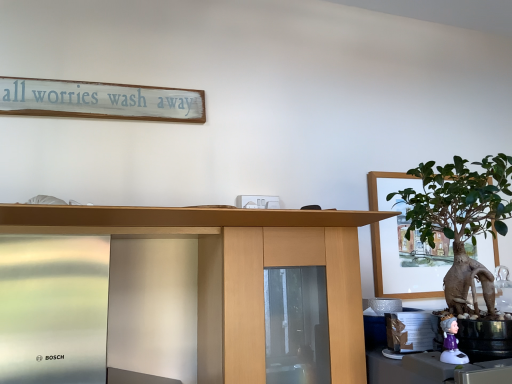
Question: Considering the relative sizes of white plastic figurine at lower right and green matte houseplant at right in the image provided, is white plastic figurine at lower right thinner than green matte houseplant at right?

Choices:
 (A) no
 (B) yes

Answer: (B)

Question: Is white plastic figurine at lower right taller than green matte houseplant at right?

Choices:
 (A) yes
 (B) no

Answer: (B)

Question: Is white plastic figurine at lower right in contact with green matte houseplant at right?

Choices:
 (A) no
 (B) yes

Answer: (A)

Question: Would you say white plastic figurine at lower right is outside green matte houseplant at right?

Choices:
 (A) yes
 (B) no

Answer: (A)

Question: Is white plastic figurine at lower right not near green matte houseplant at right?

Choices:
 (A) yes
 (B) no

Answer: (B)

Question: Is white plastic figurine at lower right behind green matte houseplant at right?

Choices:
 (A) yes
 (B) no

Answer: (A)

Question: From the image's perspective, is green matte houseplant at right below wooden desk at center?

Choices:
 (A) no
 (B) yes

Answer: (A)

Question: Can we say green matte houseplant at right lies outside wooden desk at center?

Choices:
 (A) yes
 (B) no

Answer: (A)

Question: Is green matte houseplant at right thinner than wooden desk at center?

Choices:
 (A) yes
 (B) no

Answer: (A)

Question: Is green matte houseplant at right wider than wooden desk at center?

Choices:
 (A) no
 (B) yes

Answer: (A)

Question: From a real-world perspective, is green matte houseplant at right over wooden desk at center?

Choices:
 (A) yes
 (B) no

Answer: (A)

Question: Considering the relative sizes of green matte houseplant at right and wooden desk at center in the image provided, is green matte houseplant at right bigger than wooden desk at center?

Choices:
 (A) no
 (B) yes

Answer: (A)

Question: Considering the relative sizes of white painted wood signboard at upper center and white plastic figurine at lower right in the image provided, is white painted wood signboard at upper center wider than white plastic figurine at lower right?

Choices:
 (A) yes
 (B) no

Answer: (B)